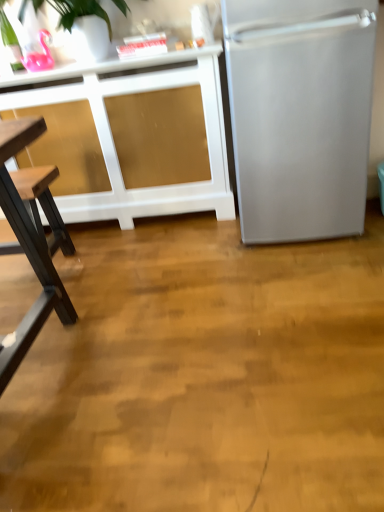
This screenshot has width=384, height=512. I want to click on vacant area that lies between white matte cabinet at upper left and satin silver refrigerator at right, so [166, 234].